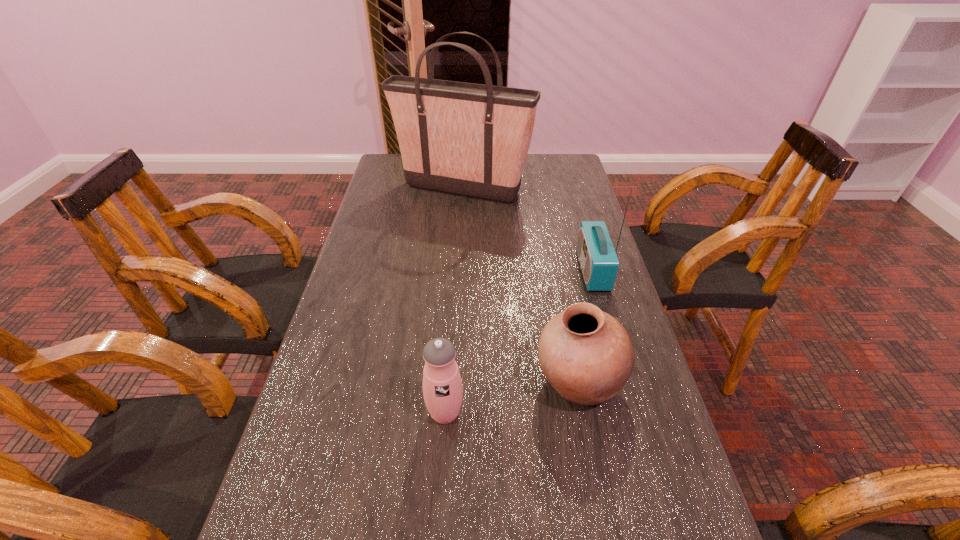
Where is `shopping bag`? Image resolution: width=960 pixels, height=540 pixels. shopping bag is located at coordinates (468, 139).

Find the location of a particular element. The image size is (960, 540). the tallest object is located at coordinates (468, 139).

Find the location of `the second farthest object`. the second farthest object is located at coordinates point(599,263).

Identify the location of radio receiver. (599, 263).

You are a GUI agent. You are given a task and a screenshot of the screen. Output one action in this format:
    pyautogui.click(x=<x>, y=<y>)
    Task: Click on the thermos bottle
    The image size is (960, 540).
    Given the screenshot: What is the action you would take?
    pyautogui.click(x=442, y=386)

Locate an element on the screen. This screenshot has height=540, width=960. pottery is located at coordinates (586, 355).

This screenshot has height=540, width=960. Find the location of `free space located on the back of the tallest object`. free space located on the back of the tallest object is located at coordinates (464, 165).

Where is `vacant space situated 0.270m on the front panel of the radio receiver`? vacant space situated 0.270m on the front panel of the radio receiver is located at coordinates (482, 270).

Identify the location of free spot located 0.290m on the front panel of the radio receiver. (474, 270).

The image size is (960, 540). Identify the location of vacant point located on the front panel of the radio receiver. (478, 270).